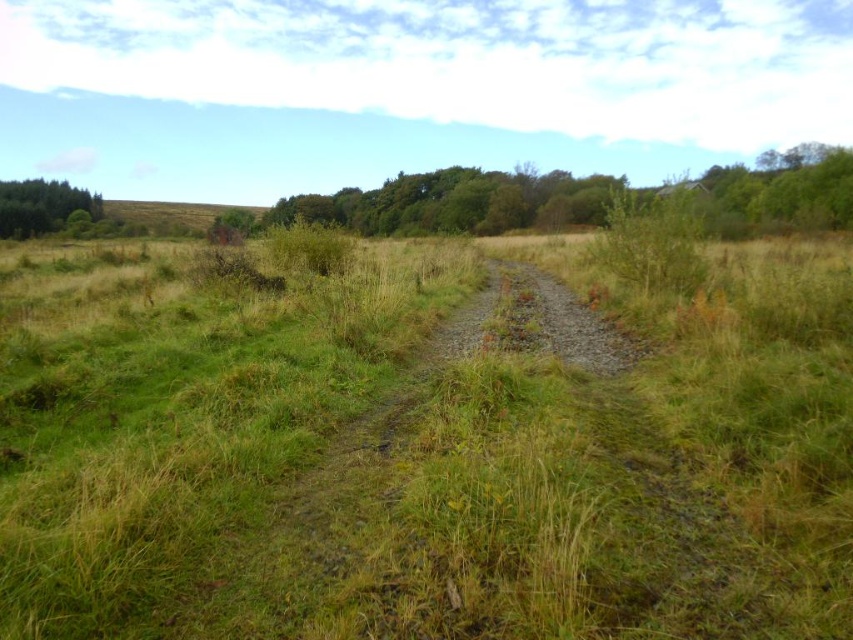
Question: Which of the following is the closest to the observer?

Choices:
 (A) (543, 477)
 (B) (59, 205)

Answer: (A)

Question: Which point is closer to the camera?

Choices:
 (A) green grassy at center
 (B) green leafy trees at left

Answer: (A)

Question: Can you confirm if green grassy at center is smaller than green leafy trees at left?

Choices:
 (A) no
 (B) yes

Answer: (B)

Question: Is green grassy at center closer to camera compared to green leafy trees at left?

Choices:
 (A) yes
 (B) no

Answer: (A)

Question: Does green grassy at center have a greater width compared to green leafy trees at left?

Choices:
 (A) no
 (B) yes

Answer: (A)